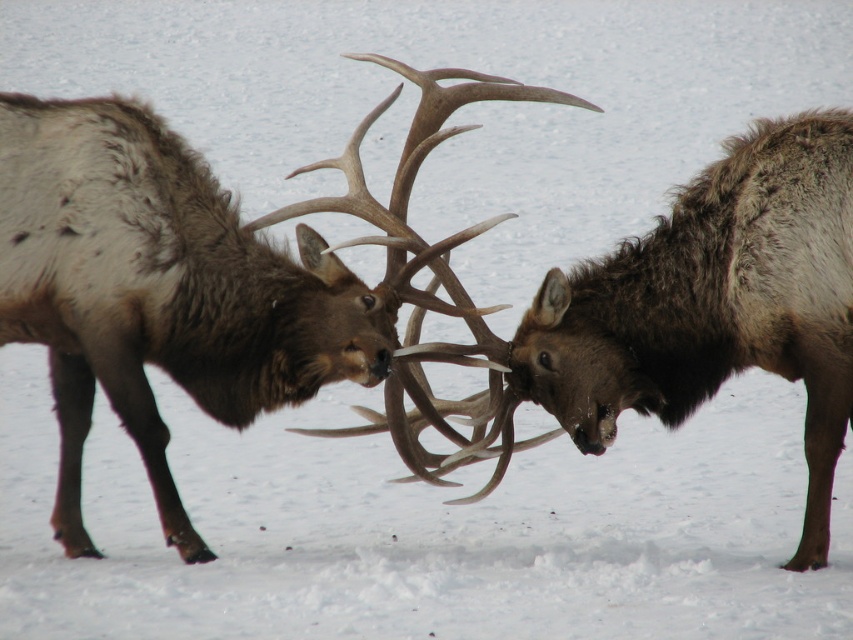
Question: Among these points, which one is farthest from the camera?

Choices:
 (A) (128, 296)
 (B) (743, 282)

Answer: (A)

Question: Is brown velvet antlers at center below brown fuzzy antlers at center?

Choices:
 (A) yes
 (B) no

Answer: (B)

Question: Does brown velvet antlers at center have a greater width compared to brown fuzzy antlers at center?

Choices:
 (A) yes
 (B) no

Answer: (A)

Question: Does brown velvet antlers at center have a greater width compared to brown fuzzy antlers at center?

Choices:
 (A) no
 (B) yes

Answer: (B)

Question: Which object is closer to the camera taking this photo?

Choices:
 (A) brown fuzzy antlers at center
 (B) brown velvet antlers at center

Answer: (B)